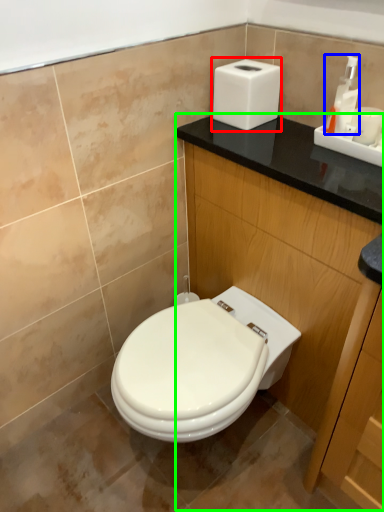
Question: Which is nearer to the hand dryer (highlighted by a red box)? soap dispenser (highlighted by a blue box) or dresser (highlighted by a green box).

Choices:
 (A) soap dispenser
 (B) dresser

Answer: (A)